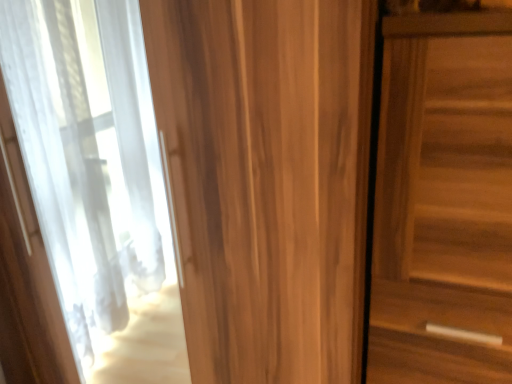
Question: In terms of size, does wooden door at right, which is counted as the second door, starting from the left, appear bigger or smaller than wooden door at center, which is the 2th door in right-to-left order?

Choices:
 (A) big
 (B) small

Answer: (B)

Question: From a real-world perspective, relative to wooden door at center, which is the 2th door in right-to-left order, is wooden door at right, which is counted as the second door, starting from the left, vertically above or below?

Choices:
 (A) above
 (B) below

Answer: (A)

Question: From the image's perspective, is wooden door at right, marked as the 1th door in a right-to-left arrangement, located above or below wooden door at center, which is the 2th door in right-to-left order?

Choices:
 (A) above
 (B) below

Answer: (B)

Question: Does point (186, 228) appear closer or farther from the camera than point (509, 23)?

Choices:
 (A) farther
 (B) closer

Answer: (A)

Question: Considering the positions of wooden door at center, which is the 2th door in right-to-left order, and wooden door at right, marked as the 1th door in a right-to-left arrangement, in the image, is wooden door at center, which is the 2th door in right-to-left order, taller or shorter than wooden door at right, marked as the 1th door in a right-to-left arrangement,?

Choices:
 (A) short
 (B) tall

Answer: (B)

Question: Is wooden door at center, which is the 2th door in right-to-left order, spatially inside wooden door at right, which is counted as the second door, starting from the left, or outside of it?

Choices:
 (A) inside
 (B) outside

Answer: (B)

Question: From a real-world perspective, is wooden door at center, which is the first door from left to right, above or below wooden door at right, which is counted as the second door, starting from the left?

Choices:
 (A) below
 (B) above

Answer: (A)